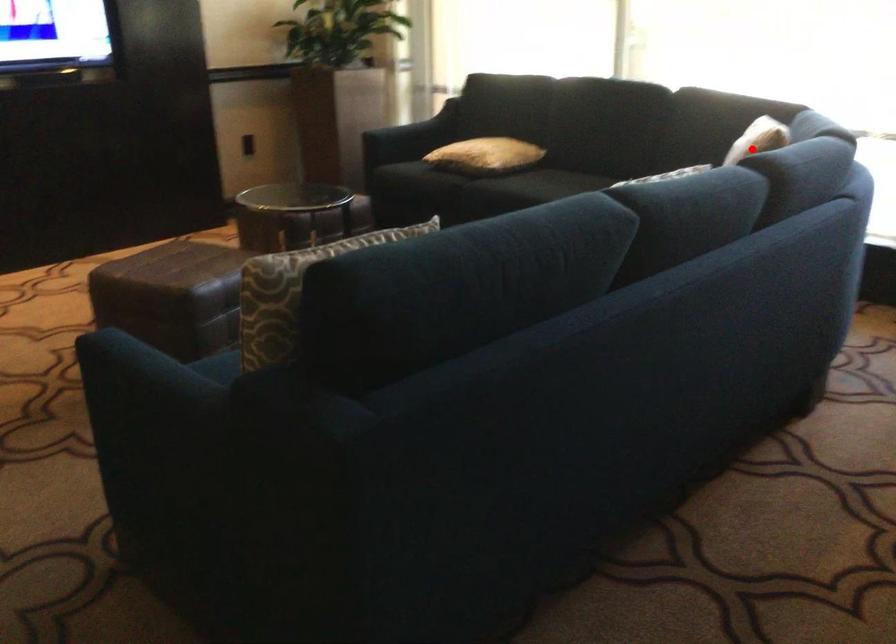
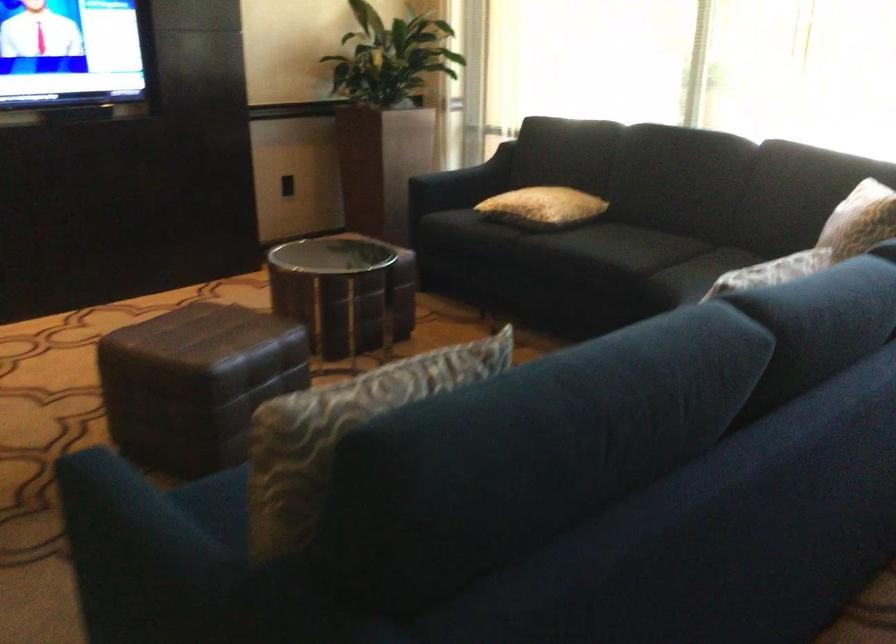
Question: I am providing you with two images of the same scene from different viewpoints. Image1 has a red point marked. In image2, the corresponding 3D location appears at what relative position? Reply with the corresponding letter.

Choices:
 (A) Closer
 (B) Farther

Answer: (A)